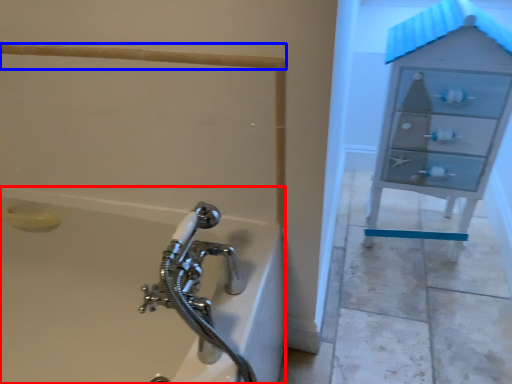
Question: Among these objects, which one is nearest to the camera, bathtub (highlighted by a red box) or rail (highlighted by a blue box)?

Choices:
 (A) bathtub
 (B) rail

Answer: (A)